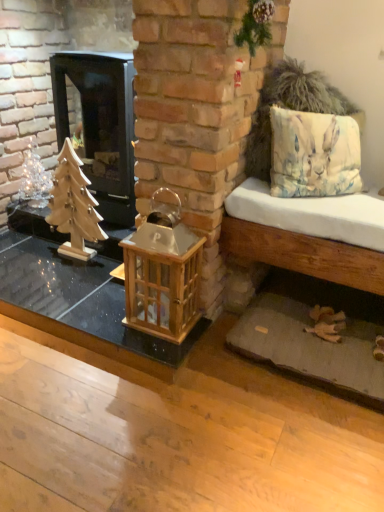
Question: Does light brown wooden bench at right appear on the right side of wooden table at center?

Choices:
 (A) yes
 (B) no

Answer: (A)

Question: From the image's perspective, is light brown wooden bench at right on wooden table at center?

Choices:
 (A) no
 (B) yes

Answer: (B)

Question: Does light brown wooden bench at right appear on the left side of wooden table at center?

Choices:
 (A) no
 (B) yes

Answer: (A)

Question: Does light brown wooden bench at right have a larger size compared to wooden table at center?

Choices:
 (A) no
 (B) yes

Answer: (B)

Question: Is light brown wooden bench at right beside wooden table at center?

Choices:
 (A) no
 (B) yes

Answer: (A)

Question: Is wooden table at center bigger or smaller than black glass wood burning stove at left?

Choices:
 (A) big
 (B) small

Answer: (B)

Question: Is point (163, 372) closer or farther from the camera than point (105, 214)?

Choices:
 (A) farther
 (B) closer

Answer: (B)

Question: Is wooden table at center in front of or behind black glass wood burning stove at left in the image?

Choices:
 (A) behind
 (B) front

Answer: (B)

Question: From a real-world perspective, is wooden table at center positioned above or below black glass wood burning stove at left?

Choices:
 (A) above
 (B) below

Answer: (B)

Question: Considering the relative positions of watercolor fabric pillow at right and wooden christmas tree at left in the image provided, is watercolor fabric pillow at right to the left or to the right of wooden christmas tree at left?

Choices:
 (A) right
 (B) left

Answer: (A)

Question: Considering the positions of watercolor fabric pillow at right and wooden christmas tree at left in the image, is watercolor fabric pillow at right bigger or smaller than wooden christmas tree at left?

Choices:
 (A) big
 (B) small

Answer: (A)

Question: Is watercolor fabric pillow at right inside the boundaries of wooden christmas tree at left, or outside?

Choices:
 (A) outside
 (B) inside

Answer: (A)

Question: Is point (284, 123) closer or farther from the camera than point (71, 224)?

Choices:
 (A) closer
 (B) farther

Answer: (A)

Question: From the image's perspective, relative to wooden lantern at center, is watercolor fabric pillow at right above or below?

Choices:
 (A) above
 (B) below

Answer: (A)

Question: In the image, is watercolor fabric pillow at right positioned in front of or behind wooden lantern at center?

Choices:
 (A) front
 (B) behind

Answer: (B)